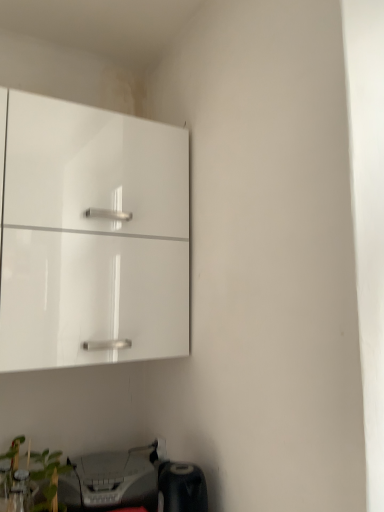
Question: Is point (39, 508) closer or farther from the camera than point (142, 457)?

Choices:
 (A) farther
 (B) closer

Answer: (B)

Question: Looking at their shapes, would you say green leafy plant at lower left is wider or thinner than matte gray printer at lower left?

Choices:
 (A) wide
 (B) thin

Answer: (B)

Question: Considering the real-world distances, which object is farthest from the glossy white cabinet at upper left?

Choices:
 (A) green leafy plant at lower left
 (B) matte gray printer at lower left

Answer: (A)

Question: Which object is positioned farthest from the glossy white cabinet at upper left?

Choices:
 (A) green leafy plant at lower left
 (B) matte gray printer at lower left

Answer: (A)